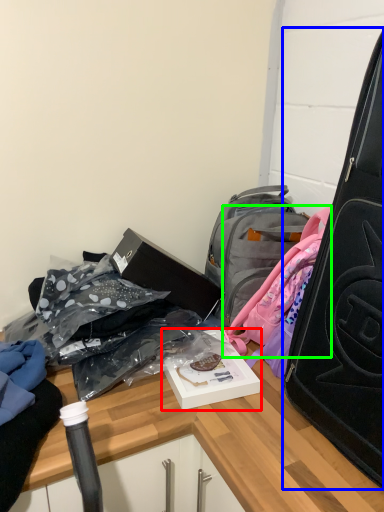
Question: Which object is the closest to the kit (highlighted by a red box)? Choose among these: suitcase (highlighted by a blue box) or backpack (highlighted by a green box).

Choices:
 (A) suitcase
 (B) backpack

Answer: (B)